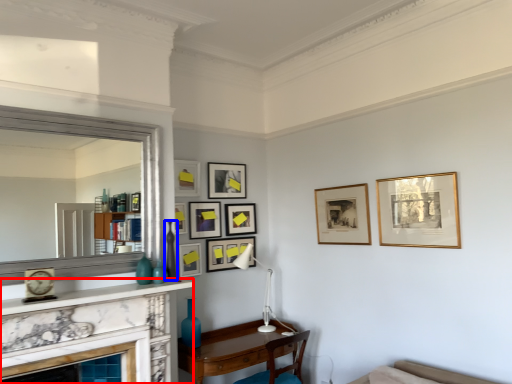
Question: Which point is further to the camera, fireplace (highlighted by a red box) or vase (highlighted by a blue box)?

Choices:
 (A) fireplace
 (B) vase

Answer: (B)